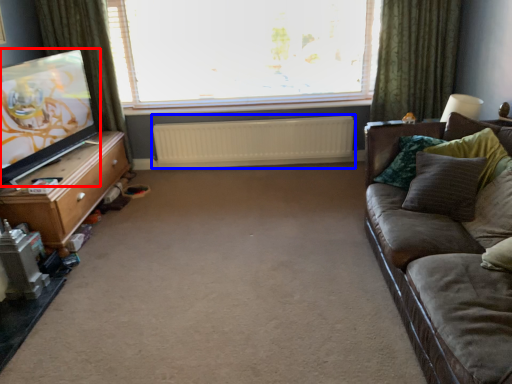
Question: Which of the following is the farthest to the observer, television (highlighted by a red box) or radiator (highlighted by a blue box)?

Choices:
 (A) television
 (B) radiator

Answer: (B)